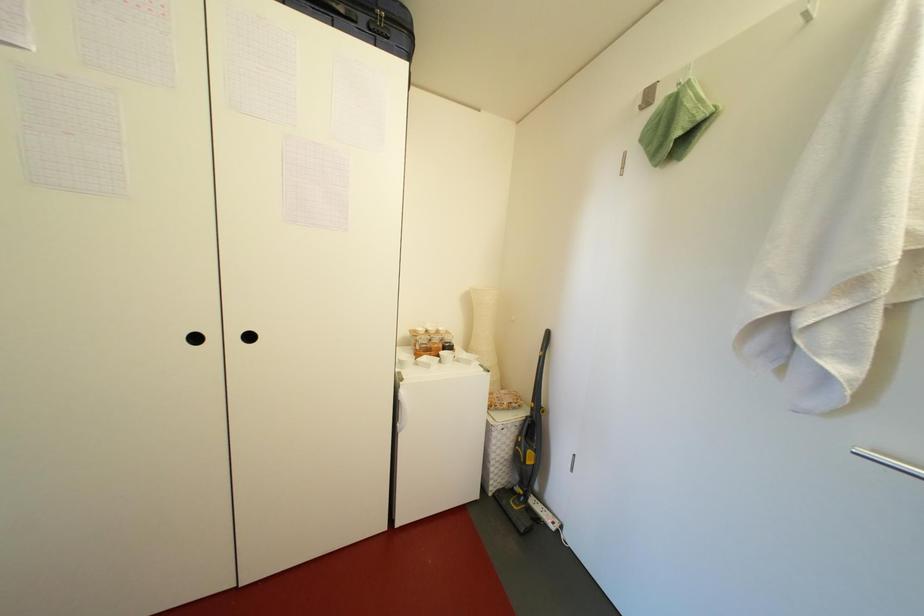
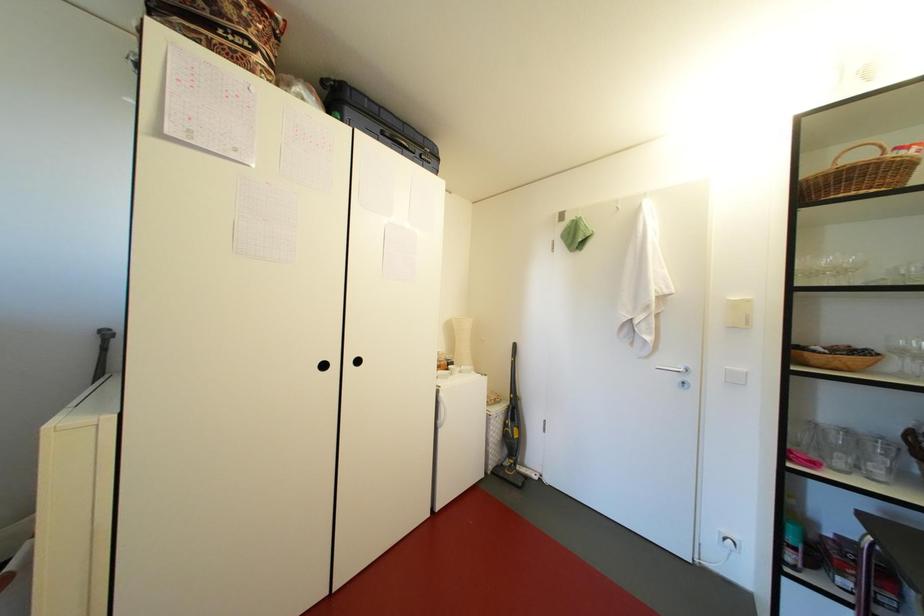
The images are taken continuously from a first-person perspective. In which direction are you moving?

The cameraman walked toward left, backward.